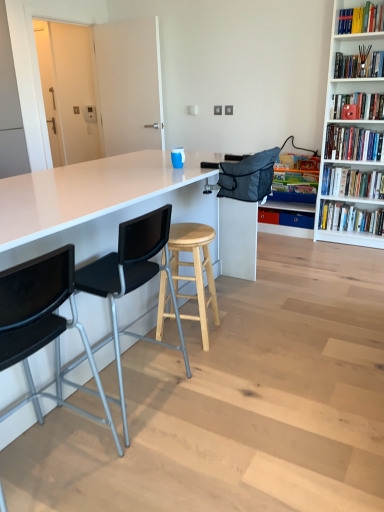
The width and height of the screenshot is (384, 512). I want to click on free location in front of natural wood stool at center, so click(196, 361).